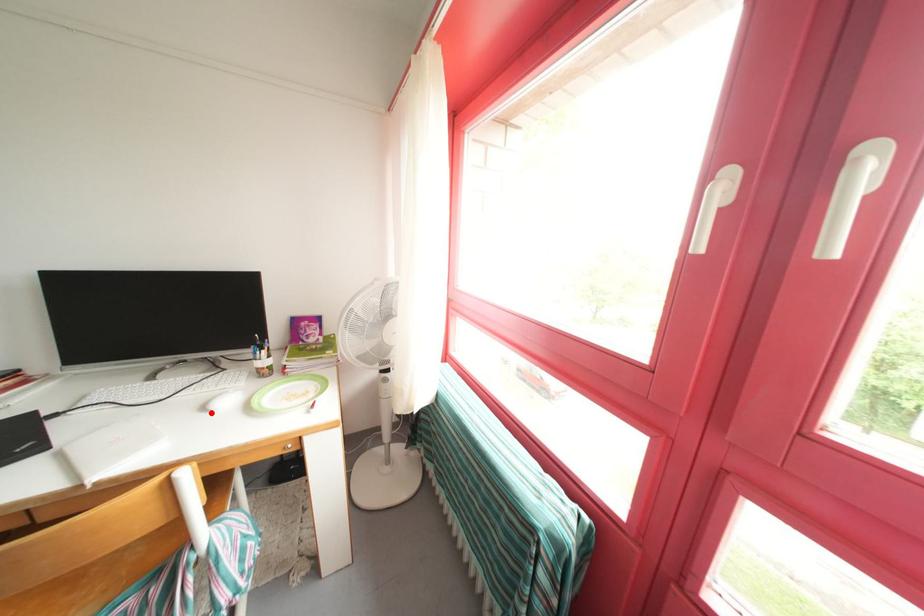
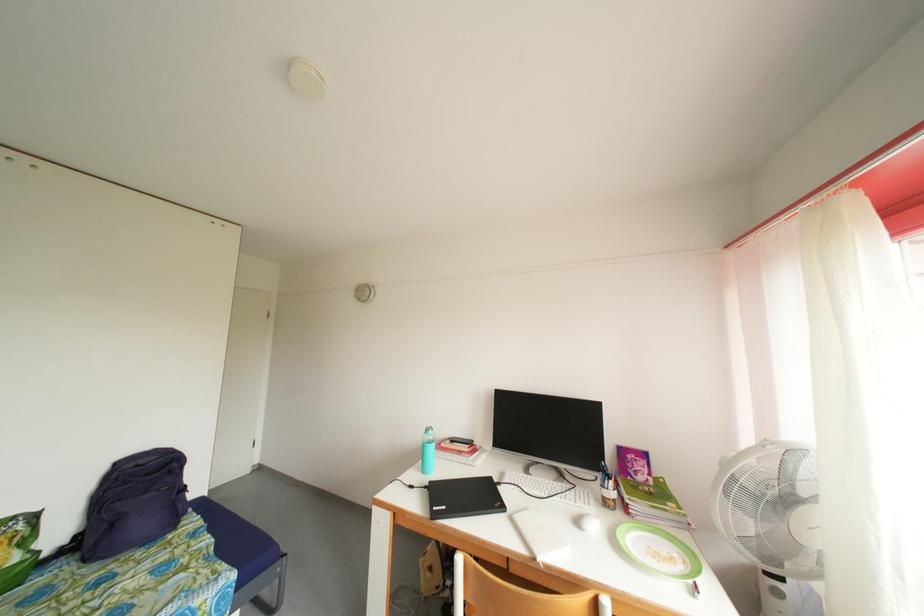
In the second image, find the point that corresponds to the highlighted location in the first image.

(585, 528)